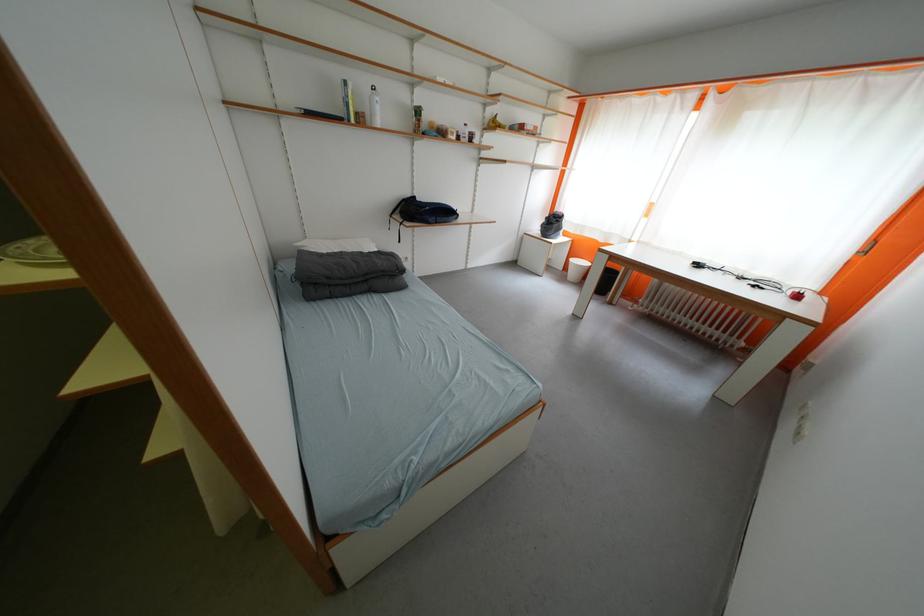
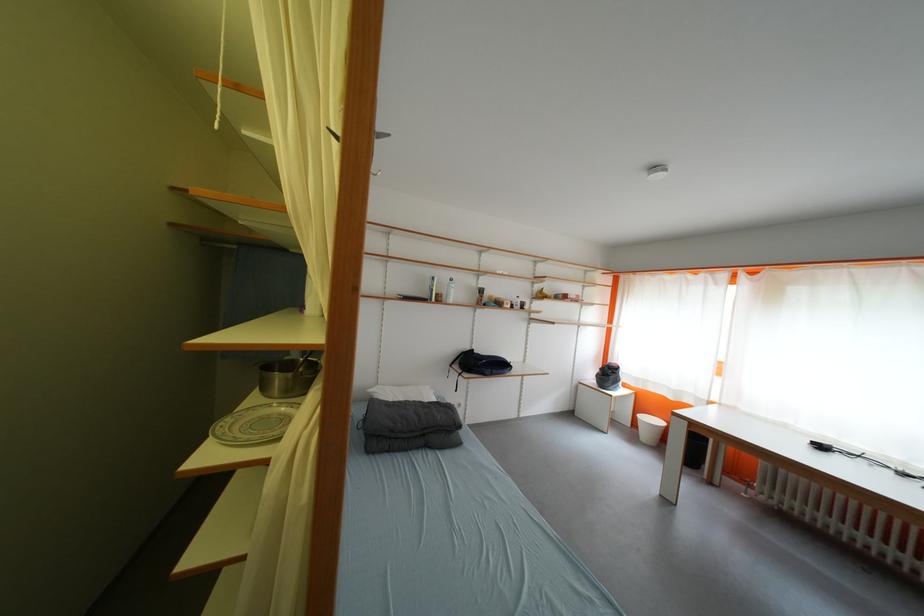
Find the pixel in the second image that matches point (43, 246) in the first image.

(237, 422)